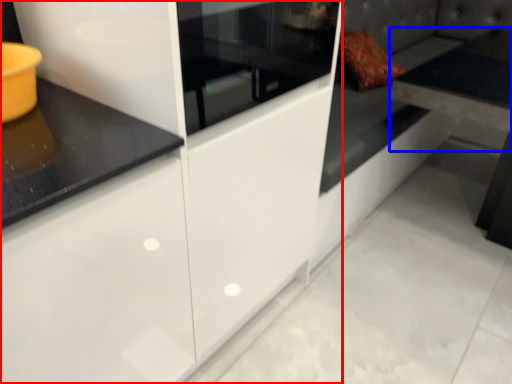
Question: Among these objects, which one is farthest to the camera, cabinetry (highlighted by a red box) or table (highlighted by a blue box)?

Choices:
 (A) cabinetry
 (B) table

Answer: (B)